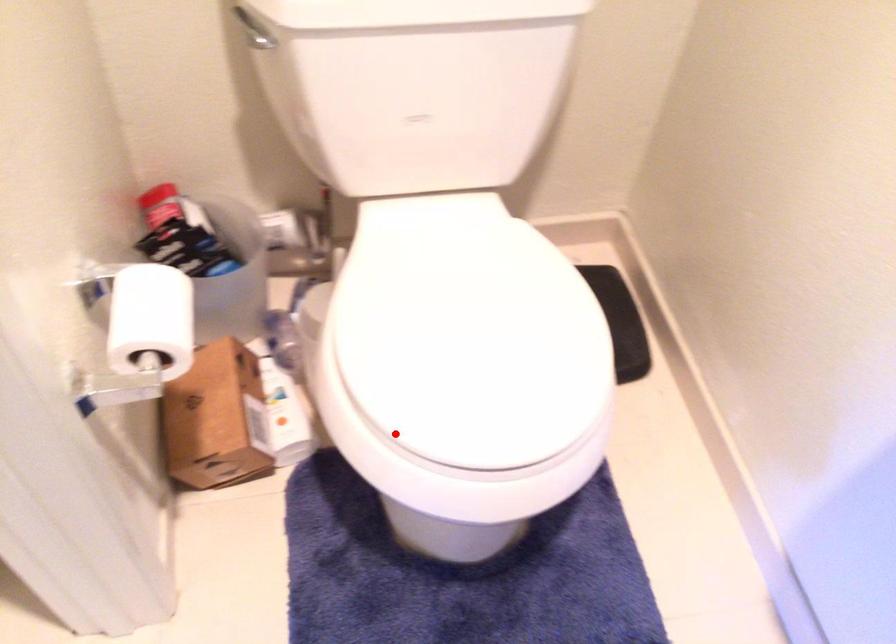
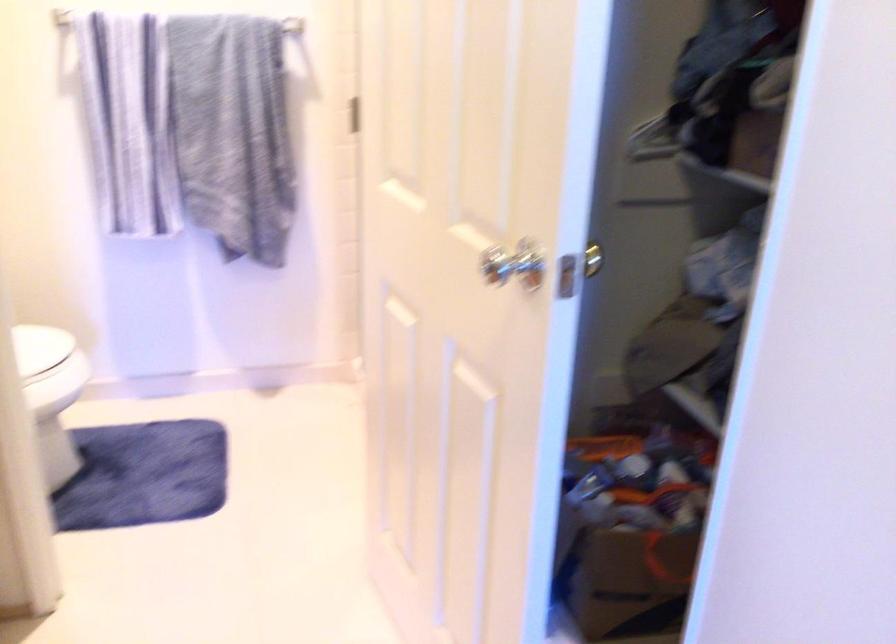
Question: I am providing you with two images of the same scene from different viewpoints. Image1 has a red point marked. In image2, the corresponding 3D location appears at what relative position? Reply with the corresponding letter.

Choices:
 (A) Closer
 (B) Farther

Answer: (B)